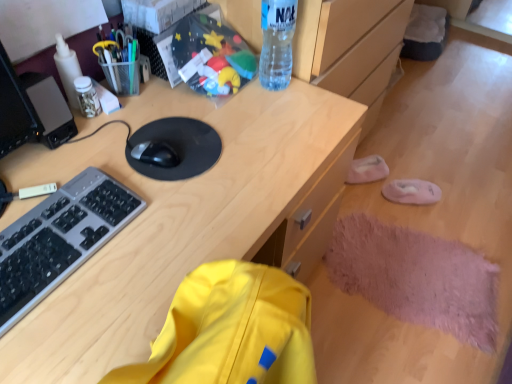
This screenshot has height=384, width=512. I want to click on free space in front of black matte mousepad at center, so click(175, 213).